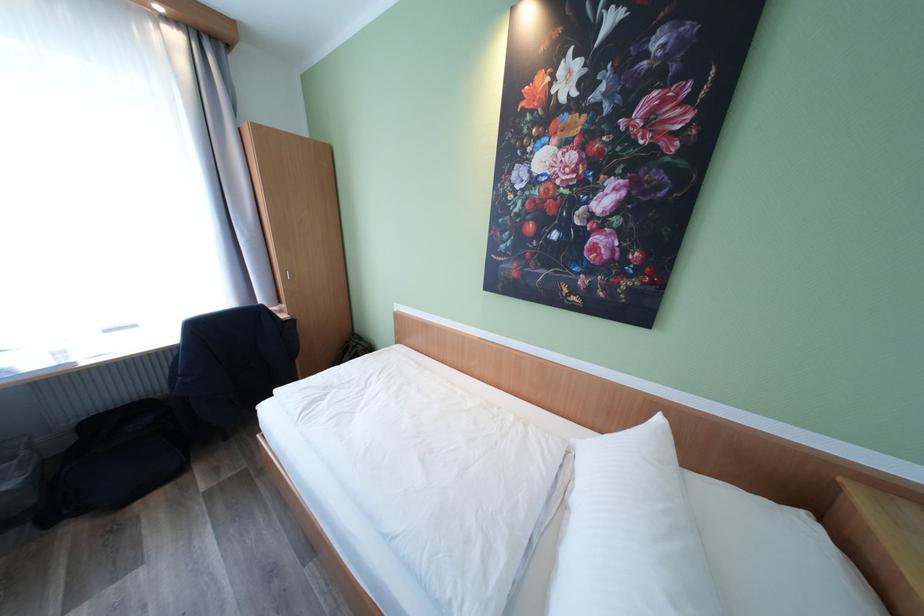
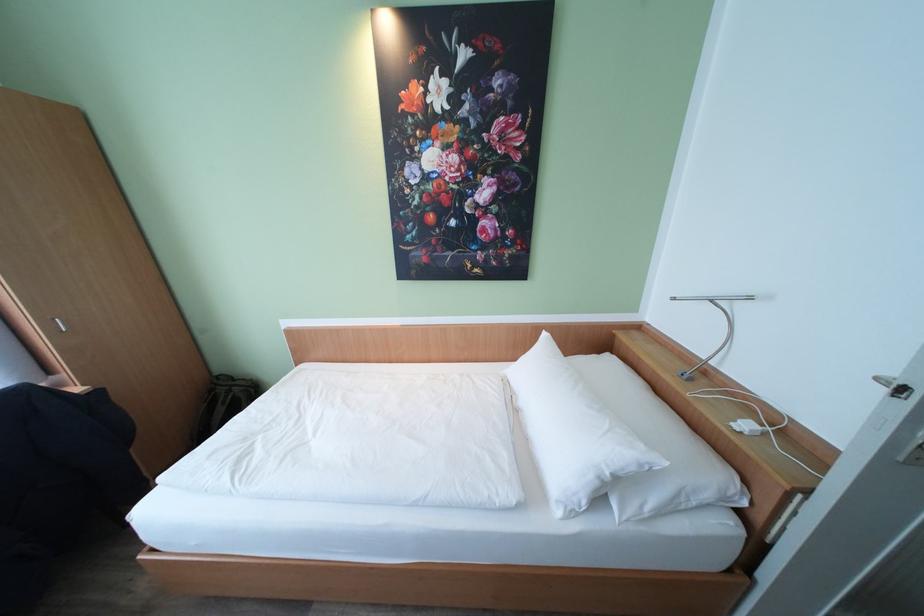
Locate, in the second image, the point that corresponds to point 365,347 in the first image.

(241, 389)